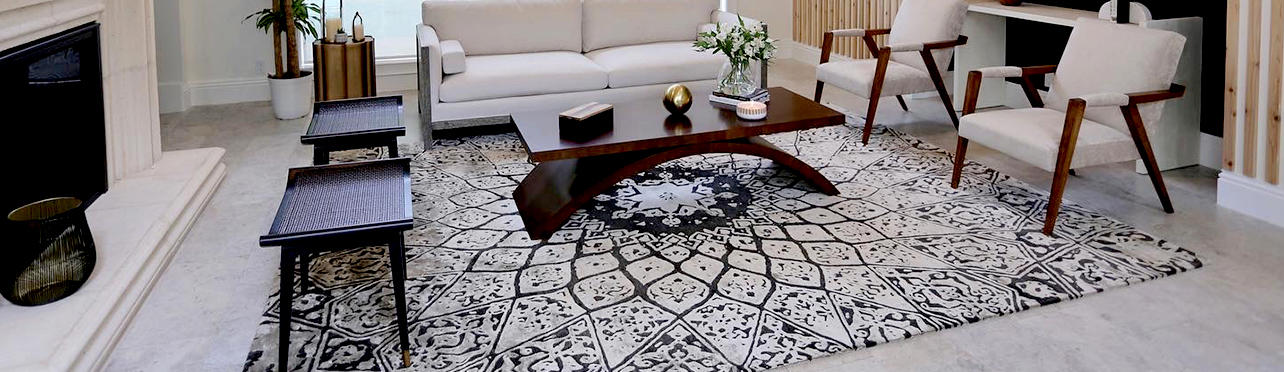
The image size is (1284, 372). I want to click on candle, so click(749, 111), click(358, 29), click(327, 24).